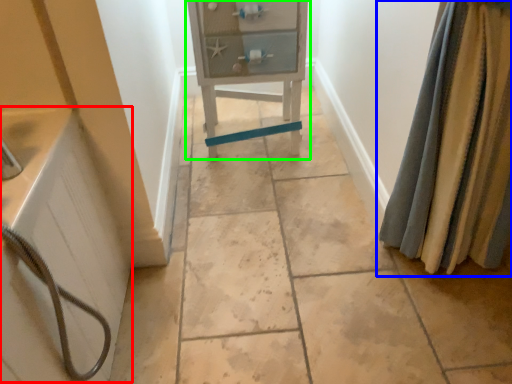
Question: Which object is positioned farthest from bath (highlighted by a red box)? Select from curtain (highlighted by a blue box) and furniture (highlighted by a green box).

Choices:
 (A) curtain
 (B) furniture

Answer: (A)